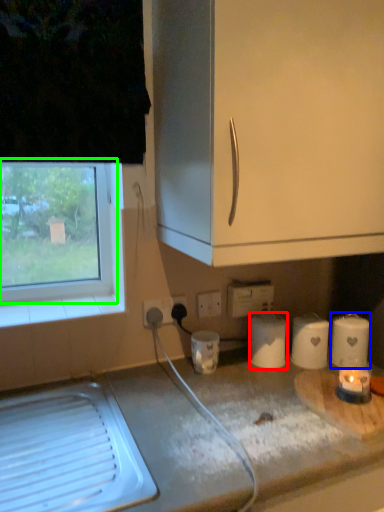
Question: Based on their relative distances, which object is farther from paper towel (highlighted by a red box)? Choose from paper towel (highlighted by a blue box) and window (highlighted by a green box).

Choices:
 (A) paper towel
 (B) window

Answer: (B)